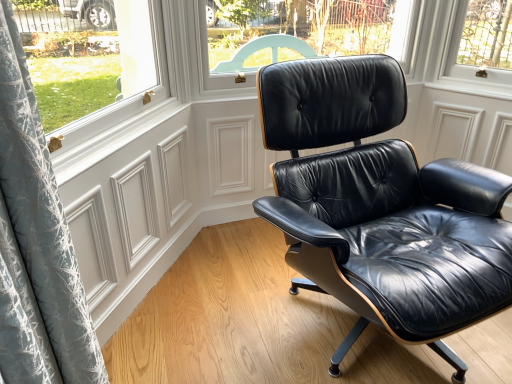
The image size is (512, 384). I want to click on free space above white matte screen door at lower left (from a real-world perspective), so click(x=125, y=138).